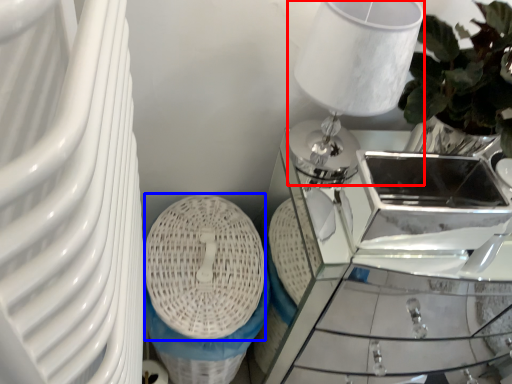
Question: Which object is closer to the camera taking this photo, table lamp (highlighted by a red box) or basket (highlighted by a blue box)?

Choices:
 (A) table lamp
 (B) basket

Answer: (A)